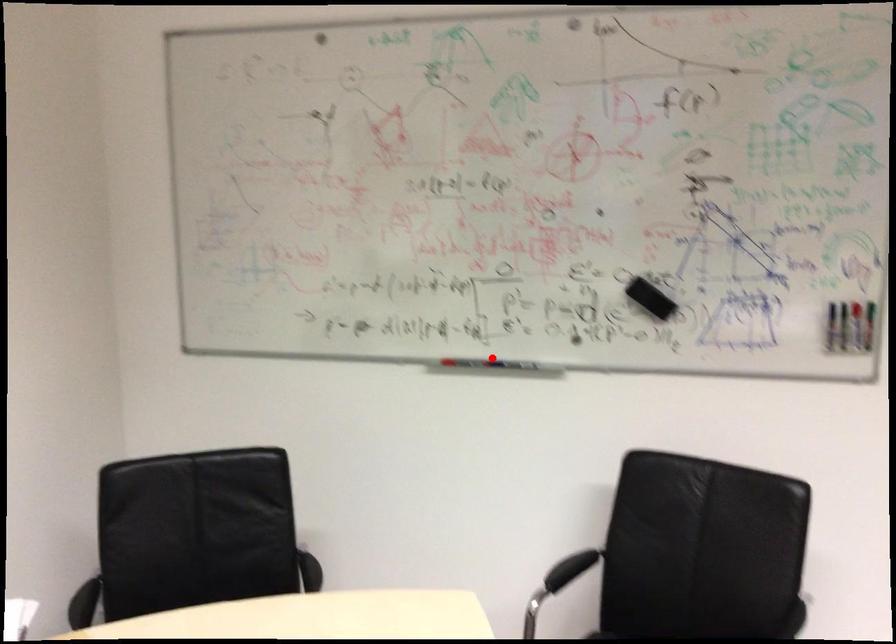
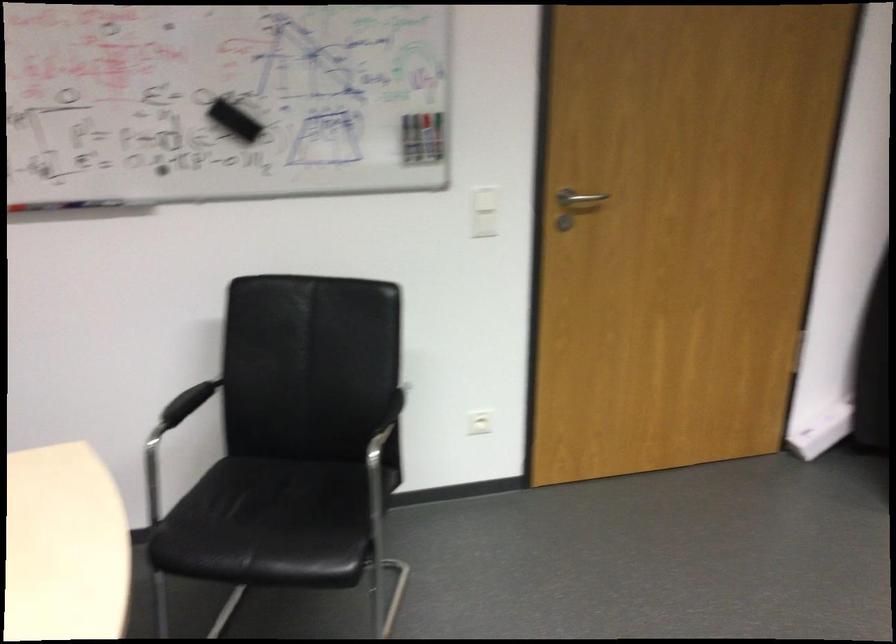
The point at the highlighted location is marked in the first image. Where is the corresponding point in the second image?

(65, 203)